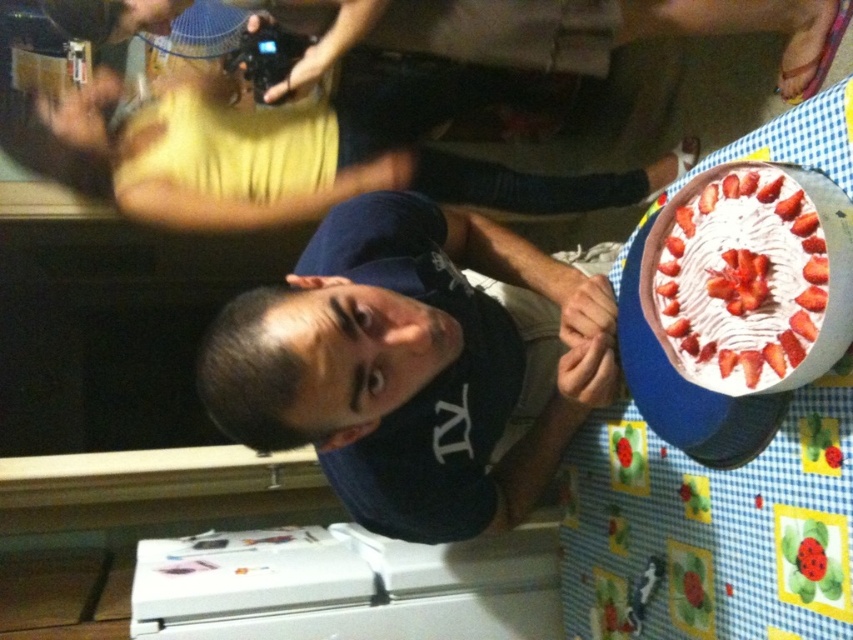
Question: Is dark blue t-shirt at center bigger than white cream cake at upper right?

Choices:
 (A) yes
 (B) no

Answer: (A)

Question: Does dark blue t-shirt at center appear on the left side of white cream cake at upper right?

Choices:
 (A) no
 (B) yes

Answer: (B)

Question: Is dark blue t-shirt at center positioned behind white cream cake at upper right?

Choices:
 (A) no
 (B) yes

Answer: (B)

Question: Among these objects, which one is nearest to the camera?

Choices:
 (A) white cream cake at upper right
 (B) dark blue t-shirt at center

Answer: (A)